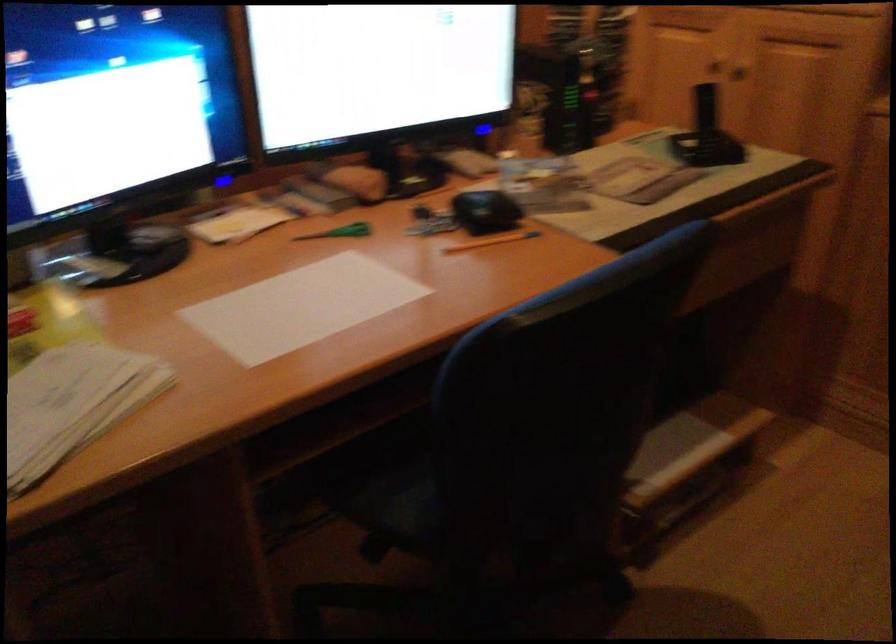
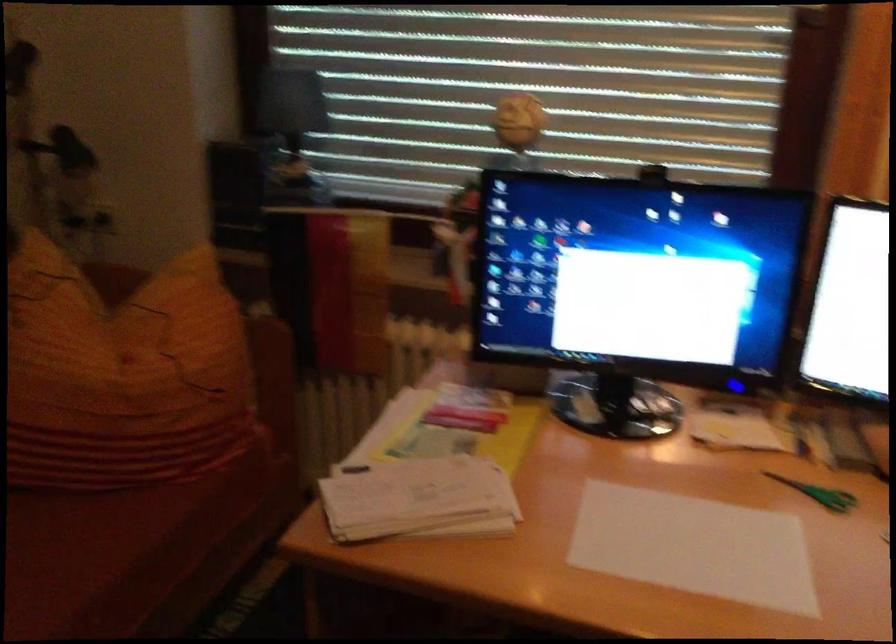
Where in the second image is the point corresponding to the point at 342,234 from the first image?

(819, 493)